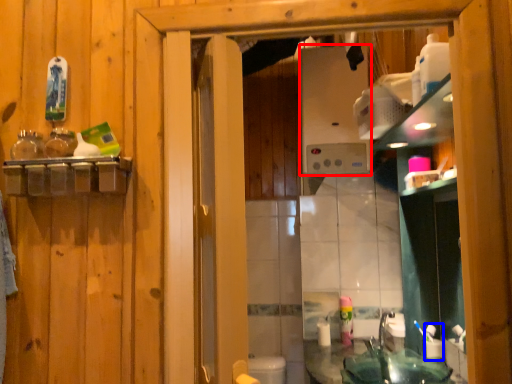
Question: Which of the following is the farthest to the observer, appliance (highlighted by a red box) or toiletry (highlighted by a blue box)?

Choices:
 (A) appliance
 (B) toiletry

Answer: (A)